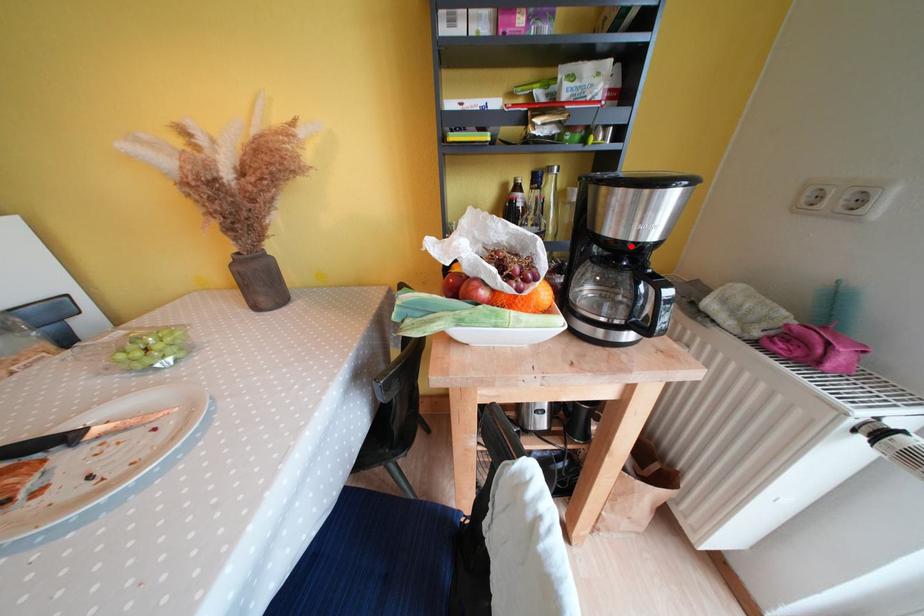
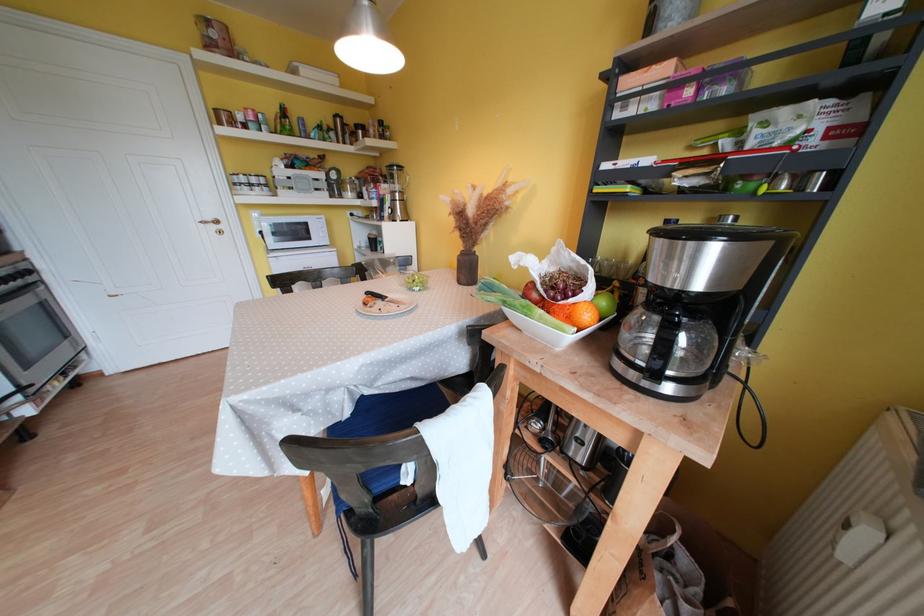
In the second image, find the point that corresponds to the highlighted location in the first image.

(669, 292)